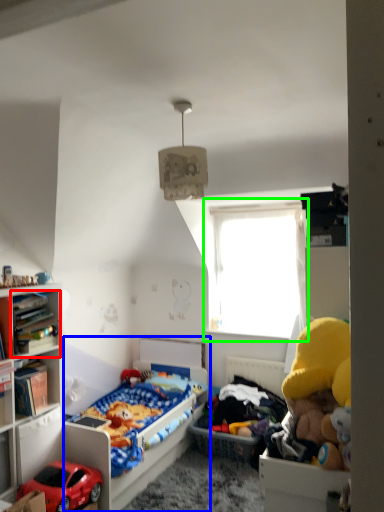
Question: Estimate the real-world distances between objects in this image. Which object is farther from cabinet (highlighted by a red box), bed (highlighted by a blue box) or window (highlighted by a green box)?

Choices:
 (A) bed
 (B) window

Answer: (B)